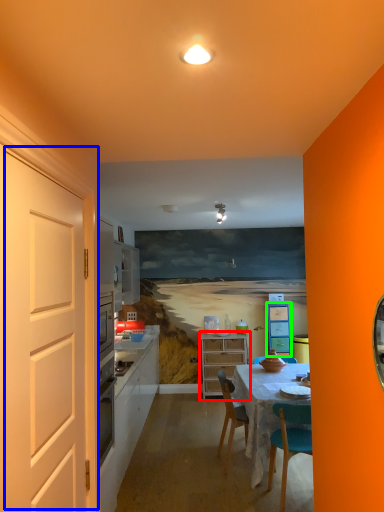
Question: Estimate the real-world distances between objects in this image. Which object is farther from cabinetry (highlighted by a red box), door (highlighted by a blue box) or cabinetry (highlighted by a green box)?

Choices:
 (A) door
 (B) cabinetry

Answer: (A)